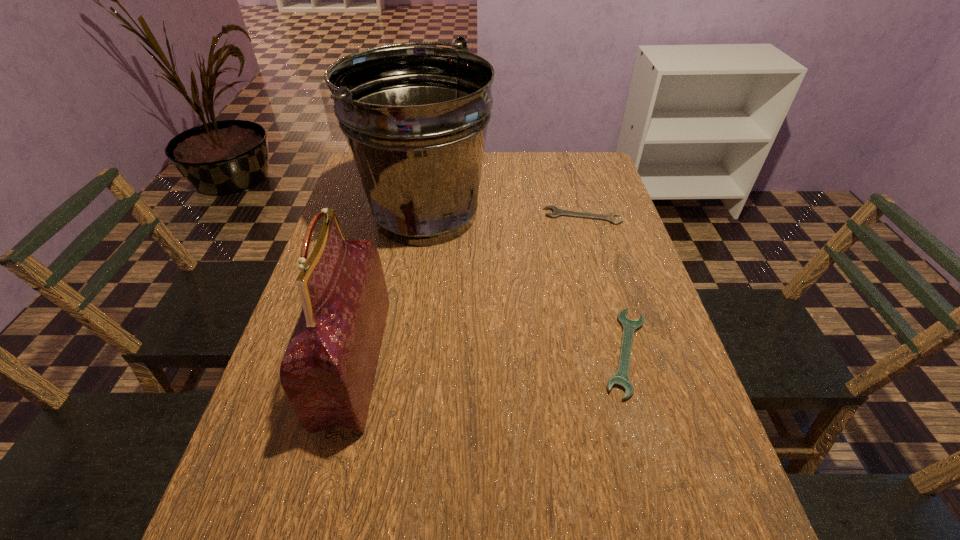
At what (x,y) coordinates should I click in order to perform the action: click on unoccupied area between the tallest object and the nearer wrench. Please return your answer as a coordinate pair (x, y). Looking at the image, I should click on point(525,284).

The height and width of the screenshot is (540, 960). Identify the location of free space between the farther wrench and the handbag. (468, 289).

At what (x,y) coordinates should I click in order to perform the action: click on vacant area between the tallest object and the nearer wrench. Please return your answer as a coordinate pair (x, y). The image size is (960, 540). Looking at the image, I should click on (525, 284).

What are the coordinates of `free space between the nearer wrench and the bucket` in the screenshot? It's located at (525, 284).

Locate an element on the screen. The height and width of the screenshot is (540, 960). vacant space that's between the farther wrench and the tallest object is located at coordinates (504, 215).

Locate an element on the screen. Image resolution: width=960 pixels, height=540 pixels. object that is the nearest to the nearer wrench is located at coordinates (415, 118).

Locate an element on the screen. The width and height of the screenshot is (960, 540). object that is the third closest to the farther wrench is located at coordinates (328, 370).

Locate an element on the screen. Image resolution: width=960 pixels, height=540 pixels. vacant space that satisfies the following two spatial constraints: 1. on the front side of the nearer wrench; 2. on the front-facing side of the second tallest object is located at coordinates (629, 362).

You are a GUI agent. You are given a task and a screenshot of the screen. Output one action in this format:
    pyautogui.click(x=<x>, y=<y>)
    Task: Click on the free space that satisfies the following two spatial constraints: 1. on the front side of the nearer wrench; 2. on the front-facing side of the handbag
    This screenshot has height=540, width=960.
    Given the screenshot: What is the action you would take?
    pyautogui.click(x=629, y=362)

Find the location of a particular element. vacant region that satisfies the following two spatial constraints: 1. on the front side of the bucket; 2. on the front-facing side of the second tallest object is located at coordinates (403, 362).